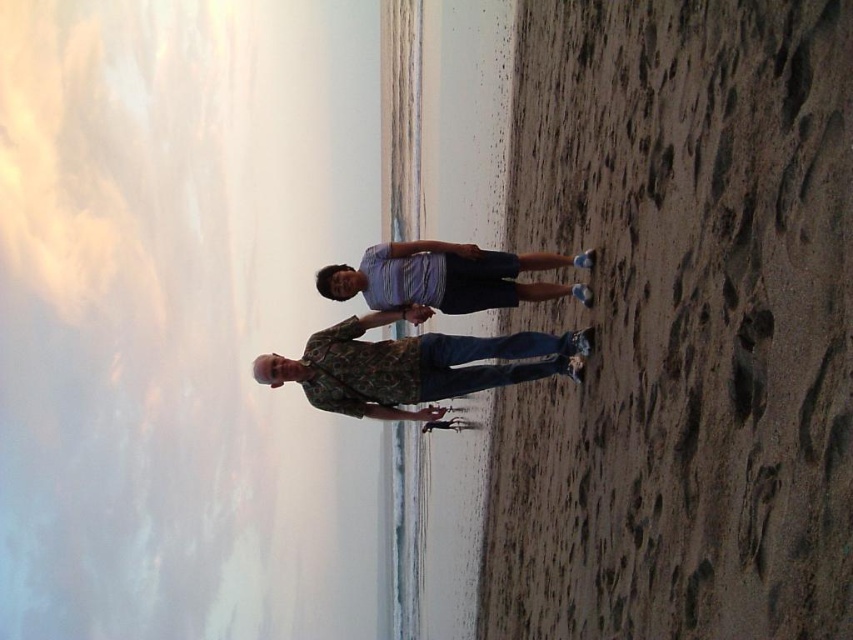
Question: Which point appears closest to the camera in this image?

Choices:
 (A) (410, 243)
 (B) (459, 353)

Answer: (B)

Question: Can you confirm if camouflage-patterned shirt at center is wider than striped cotton shirt at center?

Choices:
 (A) yes
 (B) no

Answer: (A)

Question: Observing the image, what is the correct spatial positioning of camouflage-patterned shirt at center in reference to striped cotton shirt at center?

Choices:
 (A) below
 (B) above

Answer: (A)

Question: Which of the following is the farthest from the observer?

Choices:
 (A) (413, 256)
 (B) (335, 406)

Answer: (A)

Question: Which of the following is the closest to the observer?

Choices:
 (A) striped cotton shirt at center
 (B) camouflage-patterned shirt at center

Answer: (B)

Question: Is camouflage-patterned shirt at center to the left of striped cotton shirt at center from the viewer's perspective?

Choices:
 (A) no
 (B) yes

Answer: (B)